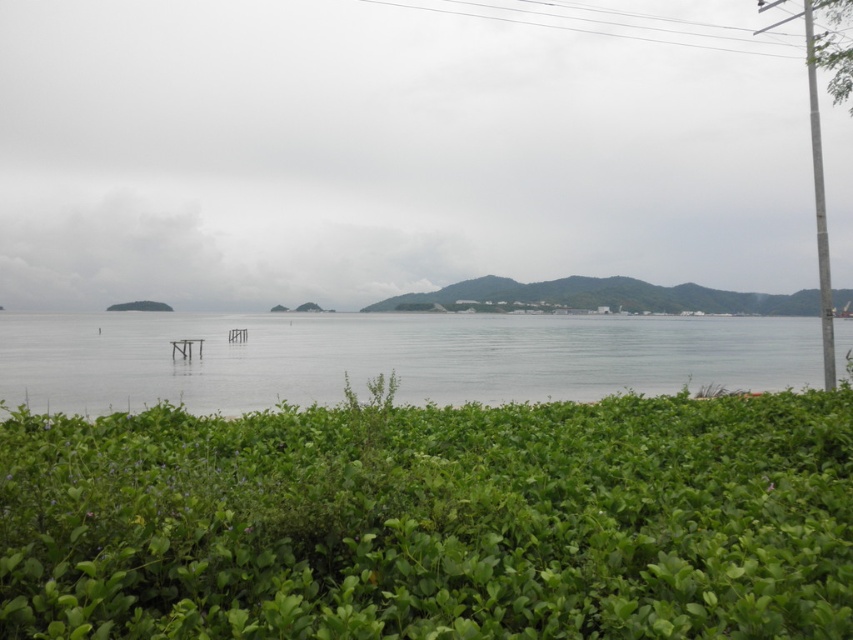
Is green leafy hedge at center taller than metallic pole at right?

No.

Can you confirm if green leafy hedge at center is smaller than metallic pole at right?

Indeed, green leafy hedge at center has a smaller size compared to metallic pole at right.

Does point (309, 605) come closer to viewer compared to point (831, 349)?

Yes, it is in front of point (831, 349).

At what (x,y) coordinates should I click in order to perform the action: click on green leafy hedge at center. Please return your answer as a coordinate pair (x, y). This screenshot has height=640, width=853. Looking at the image, I should click on (433, 520).

Is clear water at center bigger than metallic pole at right?

Incorrect, clear water at center is not larger than metallic pole at right.

You are a GUI agent. You are given a task and a screenshot of the screen. Output one action in this format:
    pyautogui.click(x=<x>, y=<y>)
    Task: Click on the clear water at center
    The image size is (853, 640).
    Given the screenshot: What is the action you would take?
    pyautogui.click(x=389, y=356)

This screenshot has height=640, width=853. I want to click on clear water at center, so click(389, 356).

Where is `clear water at center`? clear water at center is located at coordinates (389, 356).

Who is positioned more to the left, green leafy hedge at center or clear water at center?

Positioned to the left is green leafy hedge at center.

Which is more to the right, green leafy hedge at center or clear water at center?

clear water at center is more to the right.

Is point (489, 432) positioned in front of point (705, 349)?

That is True.

The height and width of the screenshot is (640, 853). I want to click on green leafy hedge at center, so click(433, 520).